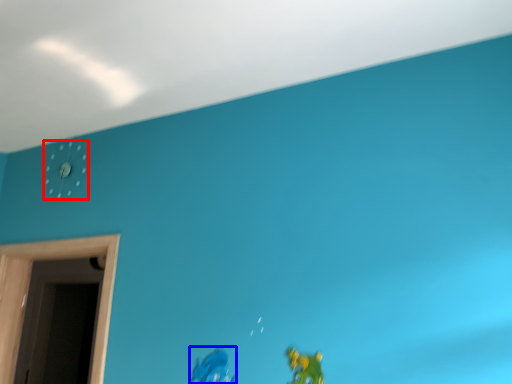
Question: Which of the following is the farthest to the observer, clock (highlighted by a red box) or toy (highlighted by a blue box)?

Choices:
 (A) clock
 (B) toy

Answer: (A)